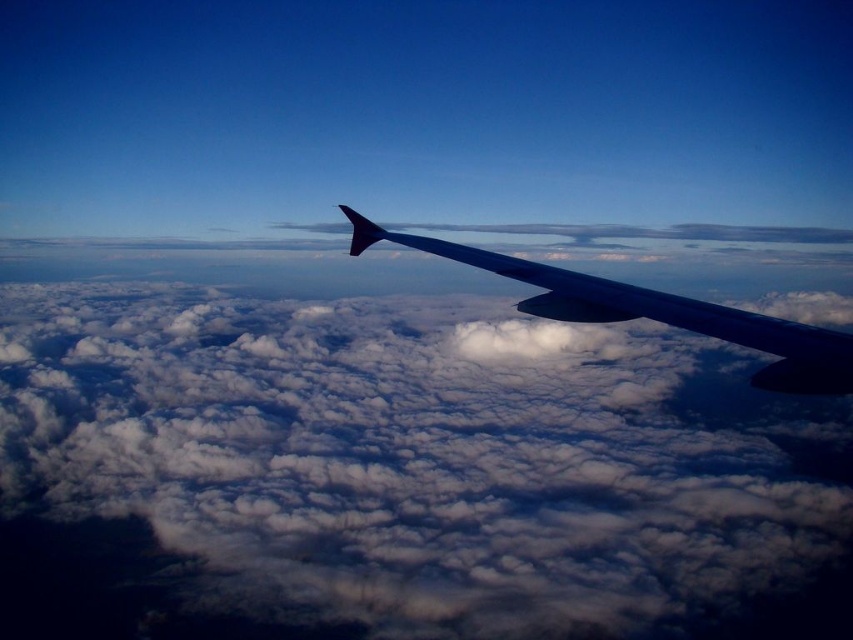
Can you confirm if white fluffy cloud at upper center is positioned to the right of metallic gray wing at center?

In fact, white fluffy cloud at upper center is to the left of metallic gray wing at center.

Which of these two, white fluffy cloud at upper center or metallic gray wing at center, stands shorter?

metallic gray wing at center

Between point (433, 404) and point (550, 275), which one is positioned in front?

Point (550, 275) is in front.

You are a GUI agent. You are given a task and a screenshot of the screen. Output one action in this format:
    pyautogui.click(x=<x>, y=<y>)
    Task: Click on the white fluffy cloud at upper center
    Image resolution: width=853 pixels, height=640 pixels.
    Given the screenshot: What is the action you would take?
    pyautogui.click(x=402, y=474)